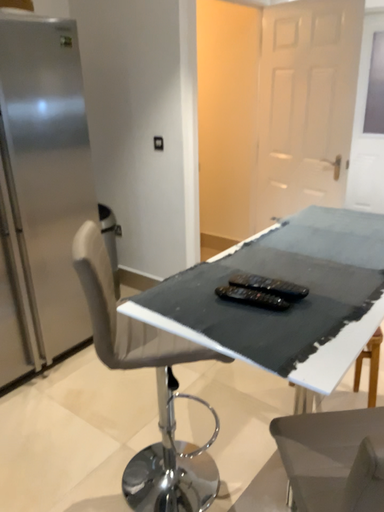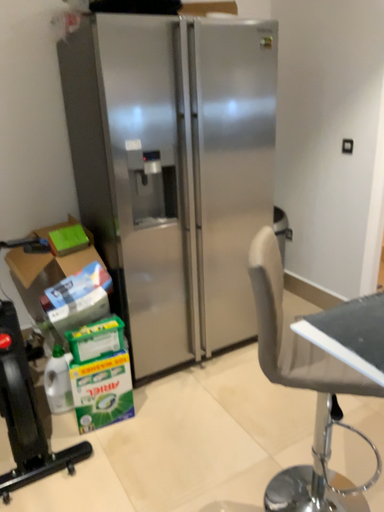
Question: How did the camera likely rotate when shooting the video?

Choices:
 (A) rotated right
 (B) rotated left

Answer: (B)